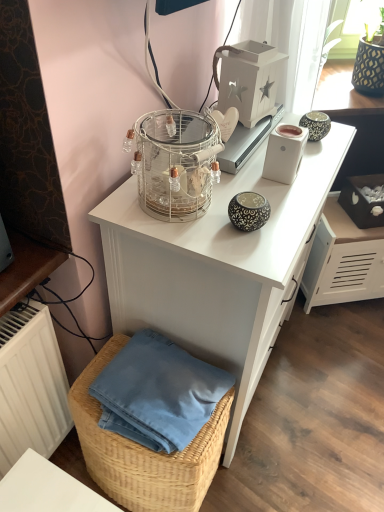
You are a GUI agent. You are given a task and a screenshot of the screen. Output one action in this format:
    pyautogui.click(x=<x>, y=<y>)
    Task: Click on the free point above woven straw basket at lower left (from a real-world perspective)
    
    Given the screenshot: What is the action you would take?
    pyautogui.click(x=148, y=392)